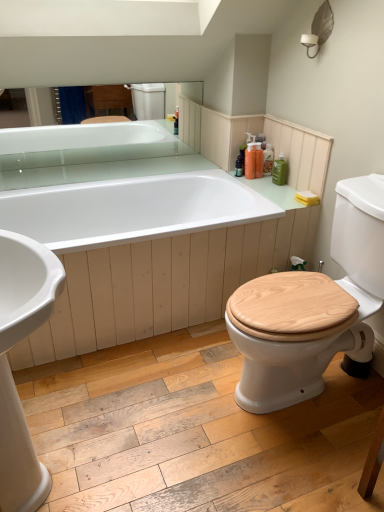
Locate an element on the screen. The height and width of the screenshot is (512, 384). vacant space positioned to the left of green matte bottle at upper right, the 1th toiletry viewed from the right is located at coordinates (263, 178).